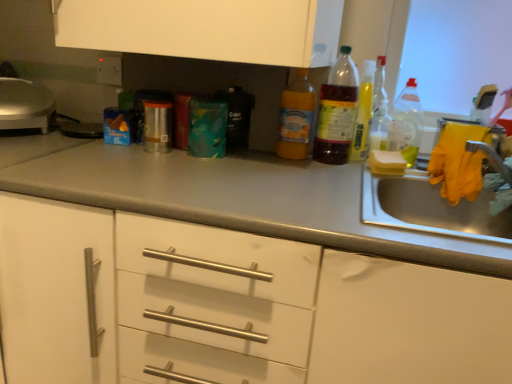
Where is `space that is in front of translucent plastic bottle at center, the 2th bottle in the left-to-right sequence`? This screenshot has height=384, width=512. space that is in front of translucent plastic bottle at center, the 2th bottle in the left-to-right sequence is located at coordinates (329, 170).